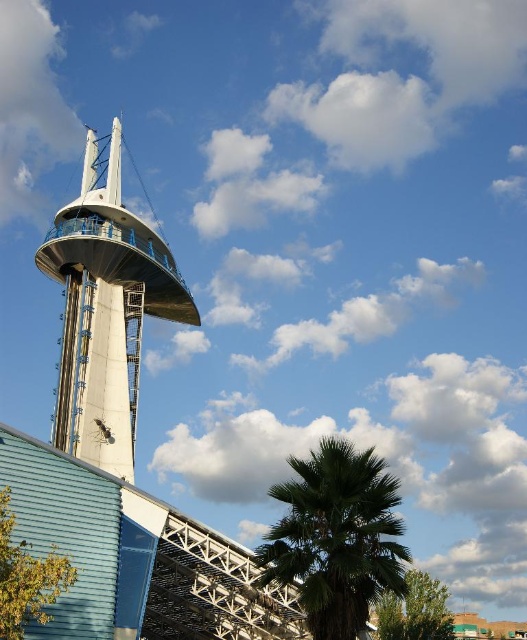
Question: Is concrete/smooth tower at center below green leafy palm at center?

Choices:
 (A) yes
 (B) no

Answer: (B)

Question: Is concrete/smooth tower at center behind green leafy palm at center?

Choices:
 (A) no
 (B) yes

Answer: (B)

Question: Which of the following is the farthest from the observer?

Choices:
 (A) concrete/smooth tower at center
 (B) green leafy palm at center

Answer: (A)

Question: Does concrete/smooth tower at center appear over green leafy palm at center?

Choices:
 (A) yes
 (B) no

Answer: (A)

Question: Which object is farther from the camera taking this photo?

Choices:
 (A) concrete/smooth tower at center
 (B) green leafy palm at center

Answer: (A)

Question: Which point is closer to the camera taking this photo?

Choices:
 (A) (64, 284)
 (B) (325, 461)

Answer: (B)